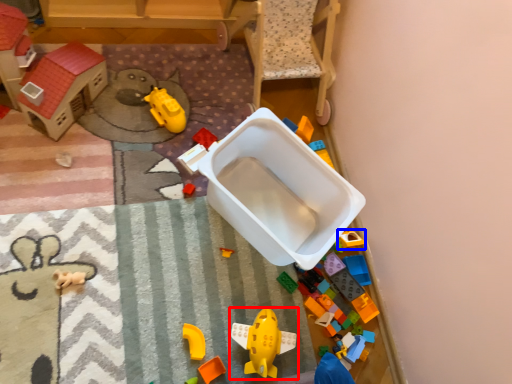
Question: Which object appears closest to the camera in this image, toy (highlighted by a red box) or toy (highlighted by a blue box)?

Choices:
 (A) toy
 (B) toy

Answer: (A)